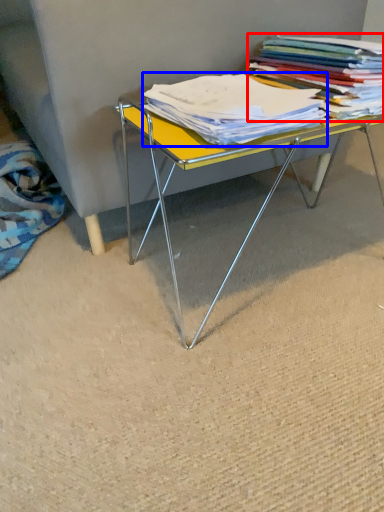
Question: Which of the following is the farthest to the observer, book (highlighted by a red box) or magazine (highlighted by a blue box)?

Choices:
 (A) book
 (B) magazine

Answer: (A)